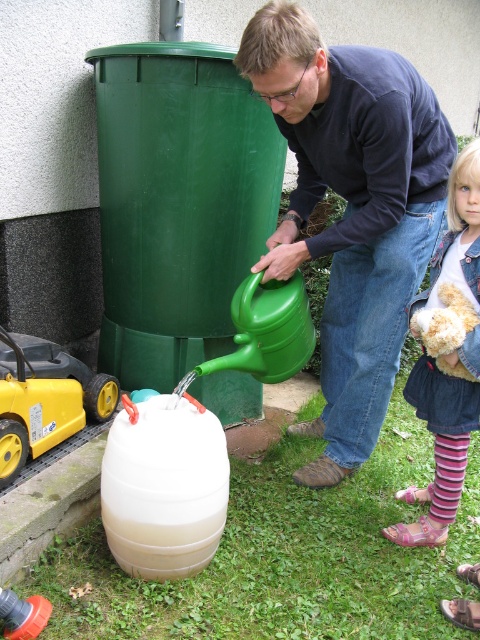
Question: Considering the real-world distances, which object is farthest from the denim jacket at lower right?

Choices:
 (A) fuzzy beige teddy bear at lower right
 (B) translucent plastic barrel at lower center
 (C) matte green watering can at center
 (D) yellow plastic toy at lower left

Answer: (D)

Question: Which of the following is the farthest from the observer?

Choices:
 (A) denim jacket at lower right
 (B) translucent plastic barrel at lower center
 (C) yellow plastic toy at lower left

Answer: (C)

Question: Based on their relative distances, which object is nearer to the matte green watering can at center?

Choices:
 (A) yellow plastic toy at lower left
 (B) fuzzy beige teddy bear at lower right

Answer: (B)

Question: From the image, what is the correct spatial relationship of translucent plastic barrel at lower center in relation to denim jacket at lower right?

Choices:
 (A) right
 (B) left

Answer: (B)

Question: Does matte green watering can at center appear under yellow plastic toy at lower left?

Choices:
 (A) yes
 (B) no

Answer: (B)

Question: Does denim jacket at lower right appear on the right side of fuzzy beige teddy bear at lower right?

Choices:
 (A) no
 (B) yes

Answer: (B)